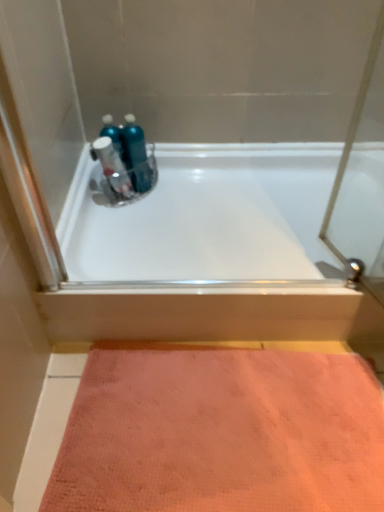
Where is `blank space situated above pink textured mat at lower center (from a real-world perspective)`? Image resolution: width=384 pixels, height=512 pixels. blank space situated above pink textured mat at lower center (from a real-world perspective) is located at coordinates (233, 419).